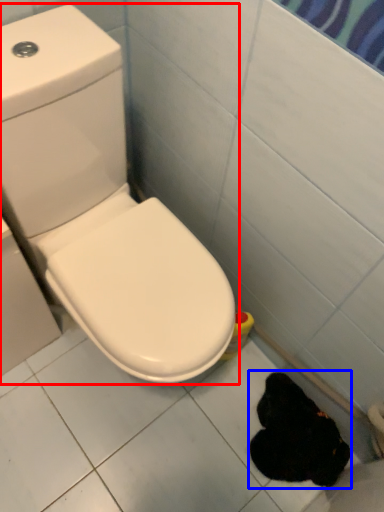
Question: Which of the following is the closest to the observer, toilet (highlighted by a red box) or animal (highlighted by a blue box)?

Choices:
 (A) toilet
 (B) animal

Answer: (A)